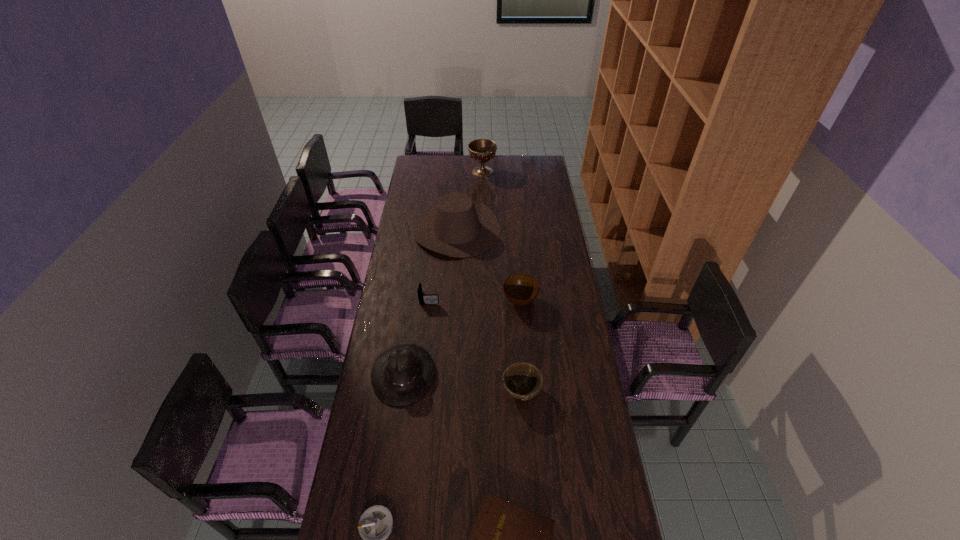
Find the location of a particular element. vacant space in between the farther bowl and the wallet is located at coordinates (475, 299).

I want to click on free space between the farther bowl and the nearer bowl, so click(x=520, y=346).

Image resolution: width=960 pixels, height=540 pixels. What are the coordinates of `object that is the third closest to the seventh nearest object` in the screenshot? It's located at (482, 150).

Select which object is the fourth closest to the chalice. Please provide its 2D coordinates. Your answer should be formatted as a tuple, i.e. [(x, y)], where the tuple contains the x and y coordinates of a point satisfying the conditions above.

[(401, 375)]

The height and width of the screenshot is (540, 960). I want to click on vacant space that satisfies the following two spatial constraints: 1. on the front-facing side of the hat; 2. on the right side of the nearer bowl, so click(401, 390).